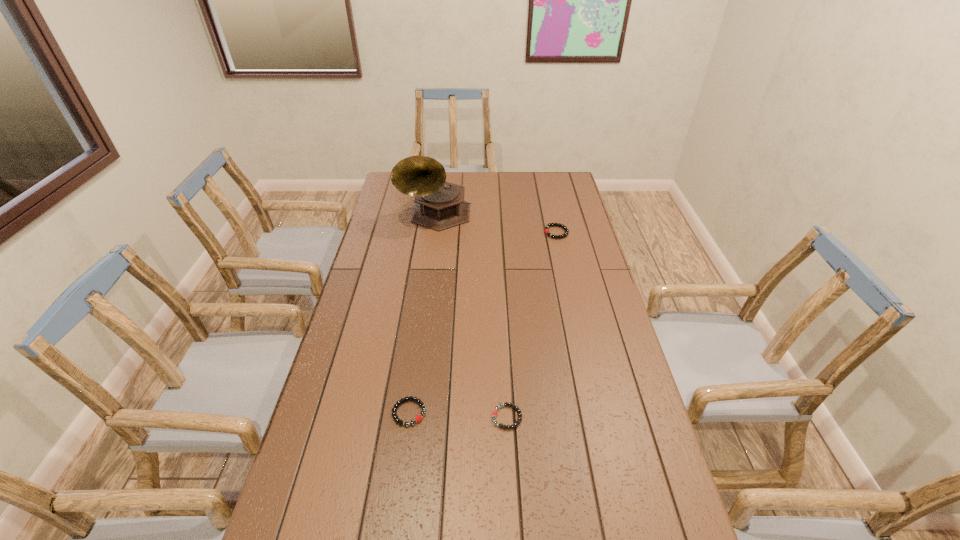
Find the location of a particular element. This screenshot has width=960, height=540. vacant region between the tallest object and the second bracelet from right to left is located at coordinates (471, 316).

Identify the location of unoccupied position between the leftmost bracelet and the third object from left to right. The image size is (960, 540). (458, 415).

Find the location of a particular element. The width and height of the screenshot is (960, 540). free space between the phonograph record and the farthest bracelet is located at coordinates (496, 224).

Image resolution: width=960 pixels, height=540 pixels. What are the coordinates of `empty space that is in between the leftmost bracelet and the third object from left to right` in the screenshot? It's located at pos(458,415).

Locate an element on the screen. unoccupied position between the second object from right to left and the leftmost bracelet is located at coordinates (458, 415).

Image resolution: width=960 pixels, height=540 pixels. I want to click on empty space between the tallest object and the second bracelet from right to left, so click(471, 316).

Select which object appears as the second closest to the third object from left to right. Please provide its 2D coordinates. Your answer should be formatted as a tuple, i.e. [(x, y)], where the tuple contains the x and y coordinates of a point satisfying the conditions above.

[(548, 225)]

Locate an element on the screen. The image size is (960, 540). object that can be found as the third closest to the leftmost bracelet is located at coordinates (548, 225).

Select which bracelet is the second closest to the farthest bracelet. Please provide its 2D coordinates. Your answer should be formatted as a tuple, i.e. [(x, y)], where the tuple contains the x and y coordinates of a point satisfying the conditions above.

[(418, 418)]

Choose which bracelet is the second nearest neighbor to the third object from left to right. Please provide its 2D coordinates. Your answer should be formatted as a tuple, i.e. [(x, y)], where the tuple contains the x and y coordinates of a point satisfying the conditions above.

[(548, 225)]